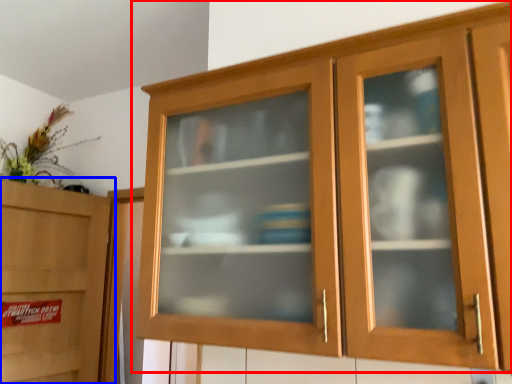
Question: Which object appears closest to the camera in this image, cupboard (highlighted by a red box) or cabinetry (highlighted by a blue box)?

Choices:
 (A) cupboard
 (B) cabinetry

Answer: (A)